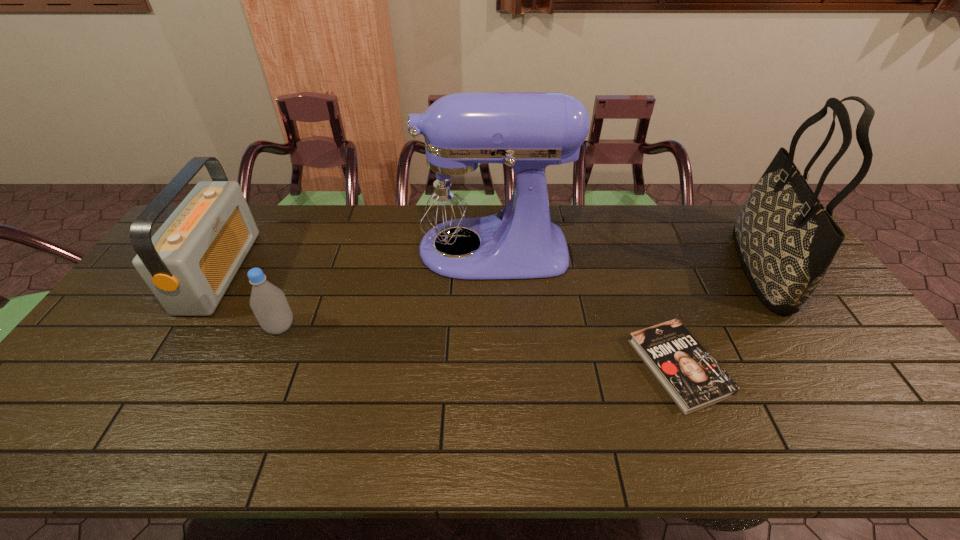
What are the coordinates of `free space located 0.220m at the mixing area of the mixer` in the screenshot? It's located at (341, 249).

The height and width of the screenshot is (540, 960). What are the coordinates of `vacant space located at the mixing area of the mixer` in the screenshot? It's located at (350, 249).

Locate an element on the screen. The image size is (960, 540). vacant space located on the front-facing side of the leftmost object is located at coordinates (324, 271).

Find the location of a particular element. vacant space located 0.300m on the left of the fourth tallest object is located at coordinates (156, 327).

I want to click on free space located 0.340m on the back of the shortest object, so click(x=633, y=247).

You are a GUI agent. You are given a task and a screenshot of the screen. Output one action in this format:
    pyautogui.click(x=<x>, y=<y>)
    Task: Click on the tote bag that is at the far edge
    The image size is (960, 540).
    Given the screenshot: What is the action you would take?
    pyautogui.click(x=786, y=240)

Find the location of a particular element. This screenshot has width=960, height=540. mixer present at the far edge is located at coordinates (455, 193).

Image resolution: width=960 pixels, height=540 pixels. Find the location of `radio receiver at the far edge`. radio receiver at the far edge is located at coordinates (189, 263).

You are a GUI agent. You are given a task and a screenshot of the screen. Output one action in this format:
    pyautogui.click(x=<x>, y=<y>)
    Task: Click on the object located at the left edge
    This screenshot has height=540, width=960.
    Given the screenshot: What is the action you would take?
    pyautogui.click(x=189, y=263)

You are a GUI agent. You are given a task and a screenshot of the screen. Output one action in this format:
    pyautogui.click(x=<x>, y=<y>)
    Task: Click on the object located at the right edge
    
    Given the screenshot: What is the action you would take?
    pyautogui.click(x=786, y=240)